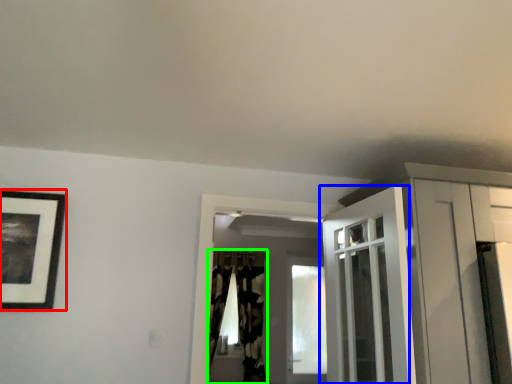
Question: Which object is positioned farthest from picture frame (highlighted by a red box)? Select from door (highlighted by a blue box) and curtain (highlighted by a green box).

Choices:
 (A) door
 (B) curtain

Answer: (B)